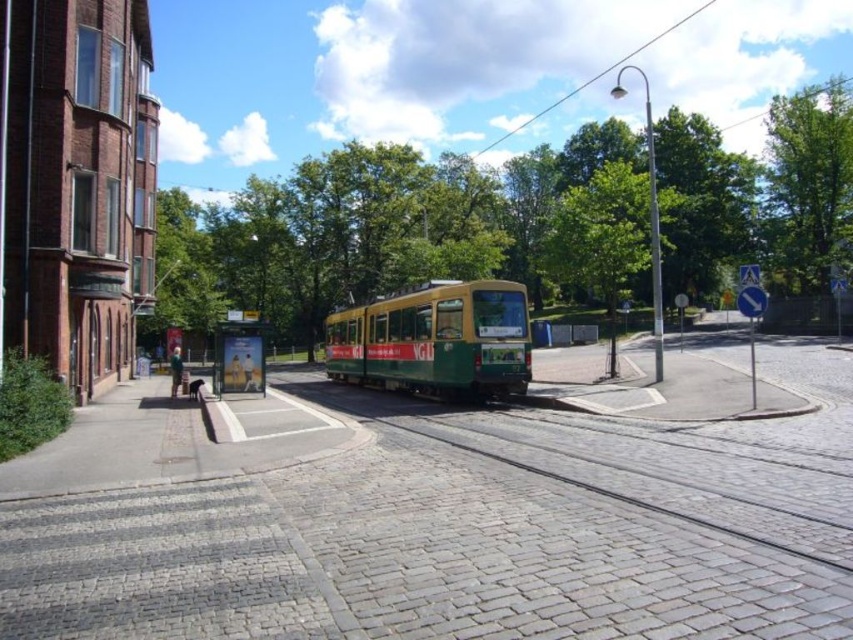
Question: Among these points, which one is nearest to the camera?

Choices:
 (A) (556, 465)
 (B) (384, 304)

Answer: (A)

Question: Does green metal train track at center appear over green matte tram at center?

Choices:
 (A) no
 (B) yes

Answer: (A)

Question: In this image, where is green metal train track at center located relative to green matte tram at center?

Choices:
 (A) left
 (B) right

Answer: (B)

Question: Observing the image, what is the correct spatial positioning of green metal train track at center in reference to green matte tram at center?

Choices:
 (A) below
 (B) above

Answer: (A)